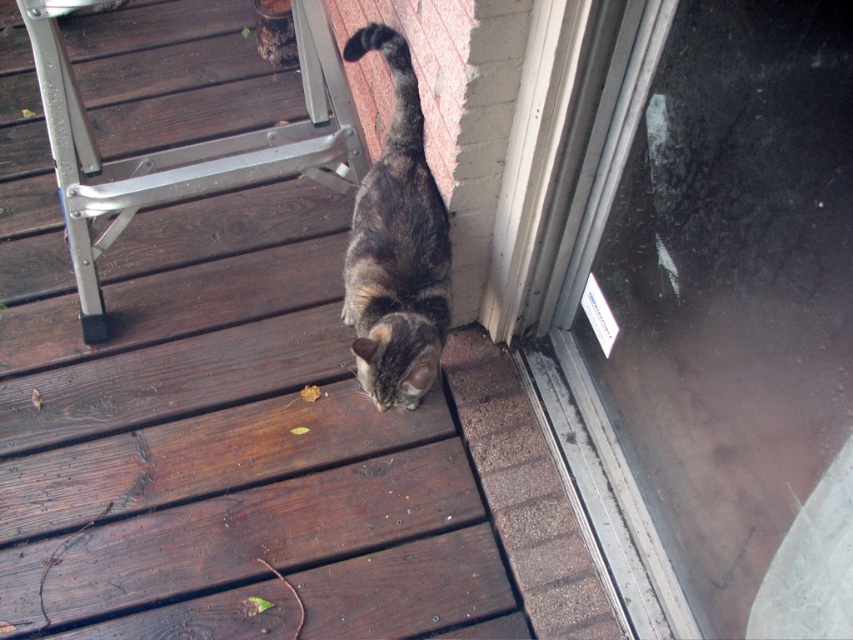
Question: Can you confirm if brown wooden deck at center is positioned to the left of tabby fur cat at lower center?

Choices:
 (A) no
 (B) yes

Answer: (B)

Question: Which point appears closest to the camera in this image?

Choices:
 (A) (270, 508)
 (B) (355, 243)

Answer: (B)

Question: Among these objects, which one is nearest to the camera?

Choices:
 (A) brown wooden deck at center
 (B) transparent glass door at lower right
 (C) tabby fur cat at lower center

Answer: (B)

Question: Does brown wooden deck at center appear over transparent glass door at lower right?

Choices:
 (A) yes
 (B) no

Answer: (A)

Question: Is brown wooden deck at center to the right of tabby fur cat at lower center from the viewer's perspective?

Choices:
 (A) no
 (B) yes

Answer: (A)

Question: Which of the following is the farthest from the observer?

Choices:
 (A) transparent glass door at lower right
 (B) brown wooden deck at center

Answer: (B)